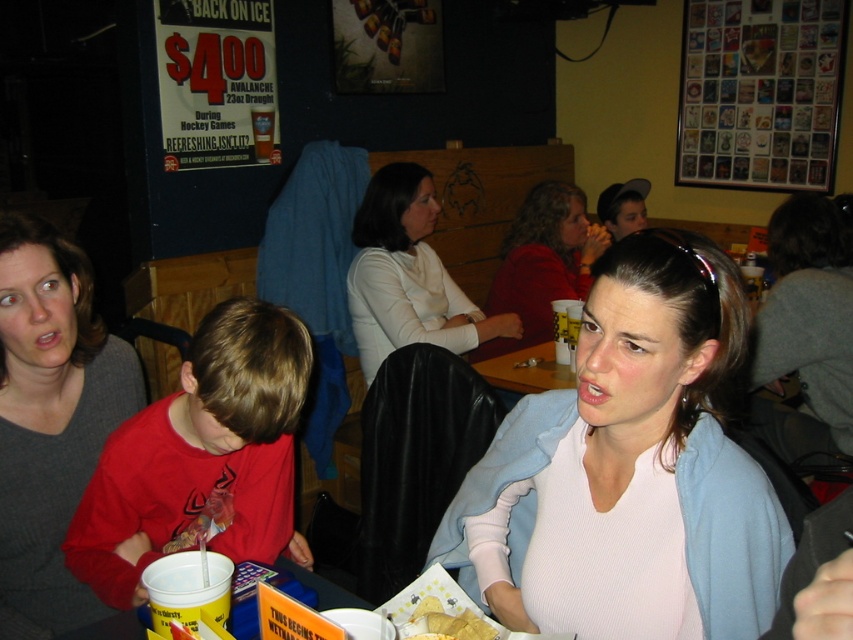
You are a waiter in a sports bar and need to place a new drink order on the table. The table has a matte red sweater at center and yellow crispy chips at lower center. Where should you place the drink to avoid spilling on either item?

You should place the drink on the left side of the yellow crispy chips at lower center since the matte red sweater at center is on the right side of the chips, leaving space to the left.